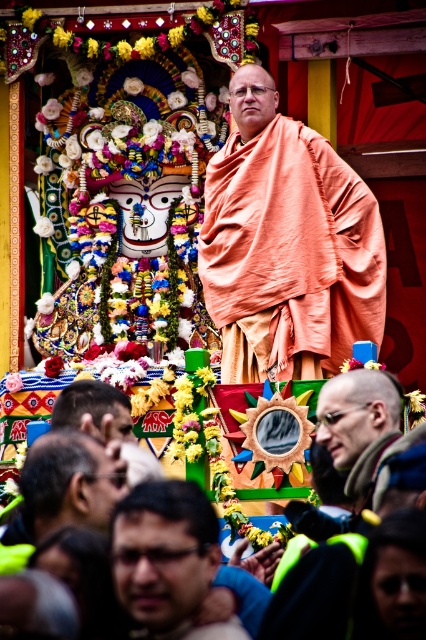
Question: Is dark brown hair at lower left to the left of brown hair at lower left from the viewer's perspective?

Choices:
 (A) yes
 (B) no

Answer: (B)

Question: Can you confirm if matte orange cloth at center is positioned above bald head at center?

Choices:
 (A) no
 (B) yes

Answer: (B)

Question: Is bald head at center to the right of brown hair at lower left from the viewer's perspective?

Choices:
 (A) yes
 (B) no

Answer: (A)

Question: Which point appears farthest from the camera in this image?

Choices:
 (A) (383, 449)
 (B) (97, 401)
 (C) (216, 275)

Answer: (C)

Question: Estimate the real-world distances between objects in this image. Which object is closer to the dark brown hair at lower left?

Choices:
 (A) brown hair at lower left
 (B) matte orange cloth at center
 (C) bald head at center

Answer: (A)

Question: Which object is closer to the camera taking this photo?

Choices:
 (A) matte orange robe at center
 (B) matte orange cloth at center

Answer: (A)